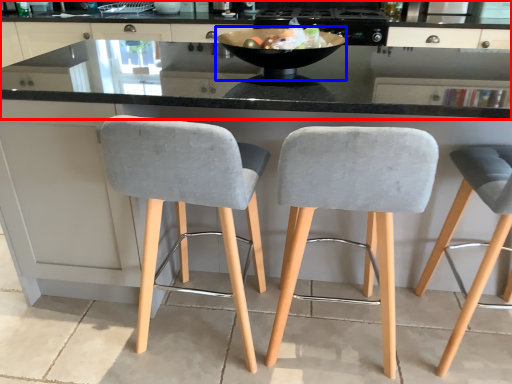
Question: Which of the following is the closest to the observer, cabinetry (highlighted by a red box) or bowl (highlighted by a blue box)?

Choices:
 (A) cabinetry
 (B) bowl

Answer: (B)